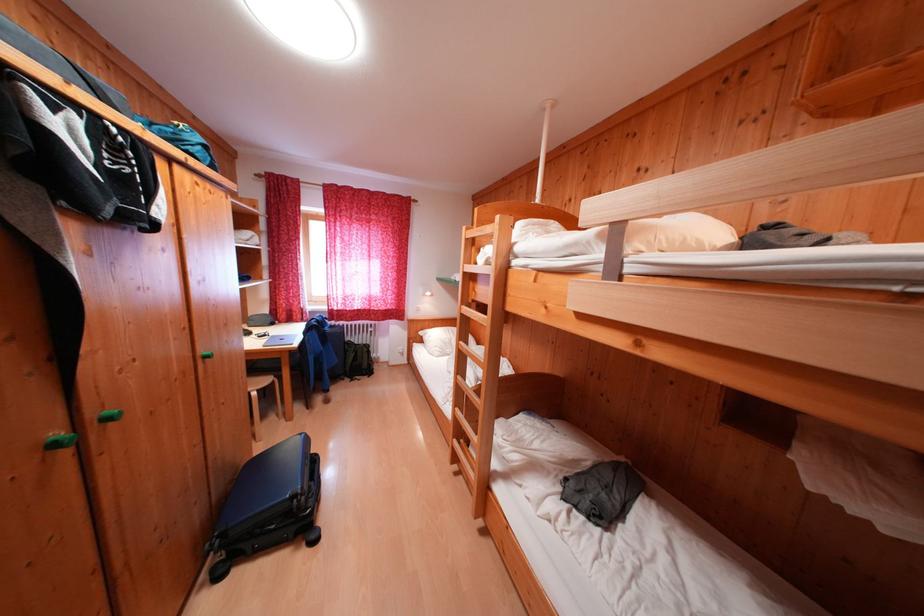
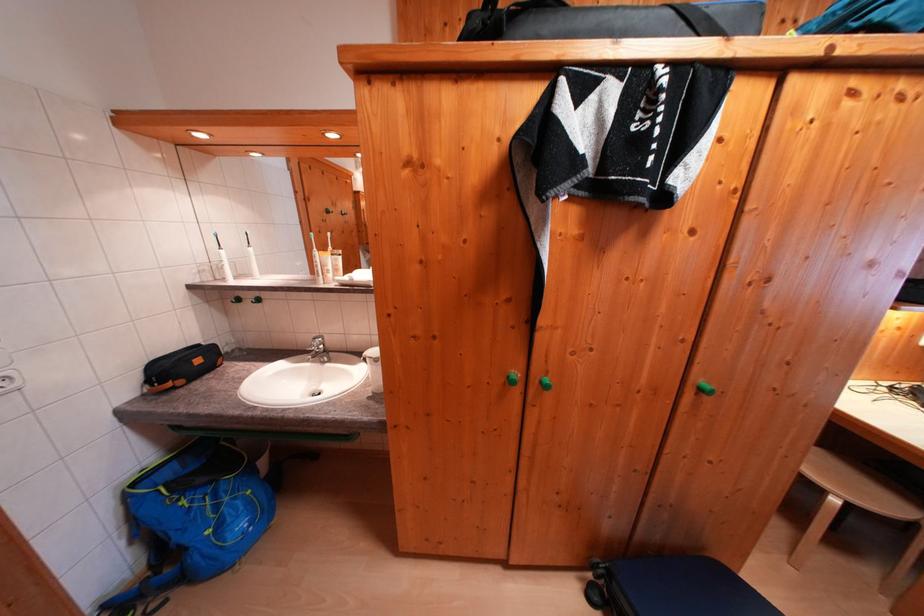
Where in the second image is the point corresponding to (115,423) from the first image?

(550, 387)